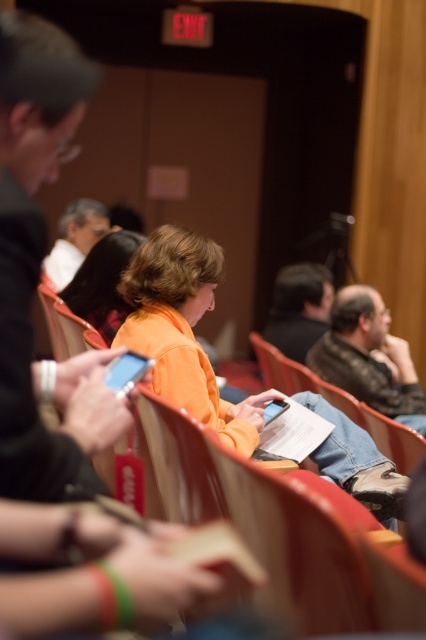
You are standing in the conference room and want to determine which of the two points, point [57,492] or point [92,305], is closer to you. Based on the scene description, which point is nearer?

Point [57,492] is closer to the viewer than point [92,305].

Based on the scene description, where is the orange matte jacket at center located in terms of coordinates?

The orange matte jacket at center is located at point coordinates of 0.517 and 0.432.

You are organizing a photo shoot in this conference room and need to ensure that the orange matte jacket at center and the dark brown hair at center are visible in the frame. Given that the camera has a fixed focal length and you can only adjust the horizontal position, which object should you prioritize positioning closer to the center of the frame to ensure both are captured without cropping?

The orange matte jacket at center should be prioritized closer to the center of the frame since its width surpasses that of the dark brown hair at center, making it more likely to be cropped if not centered properly.